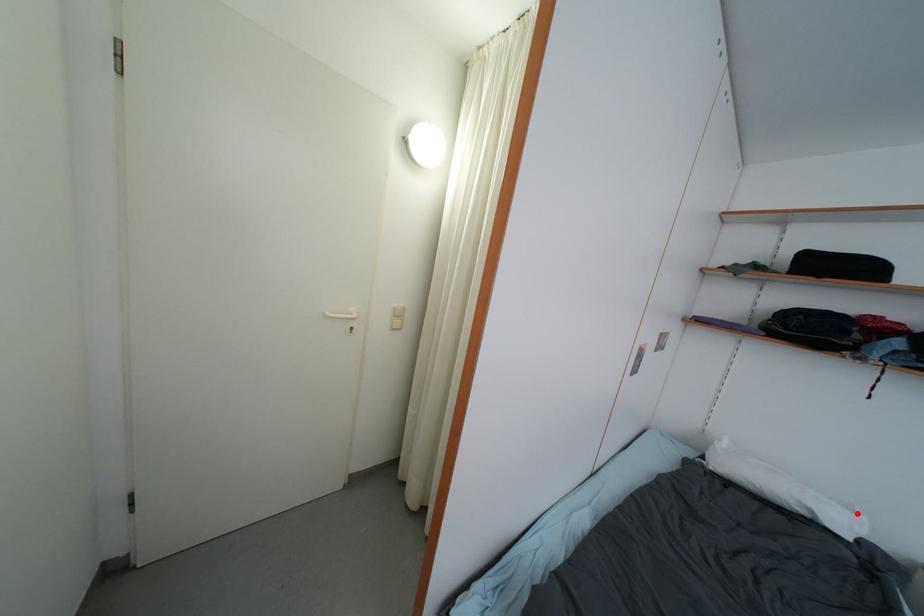
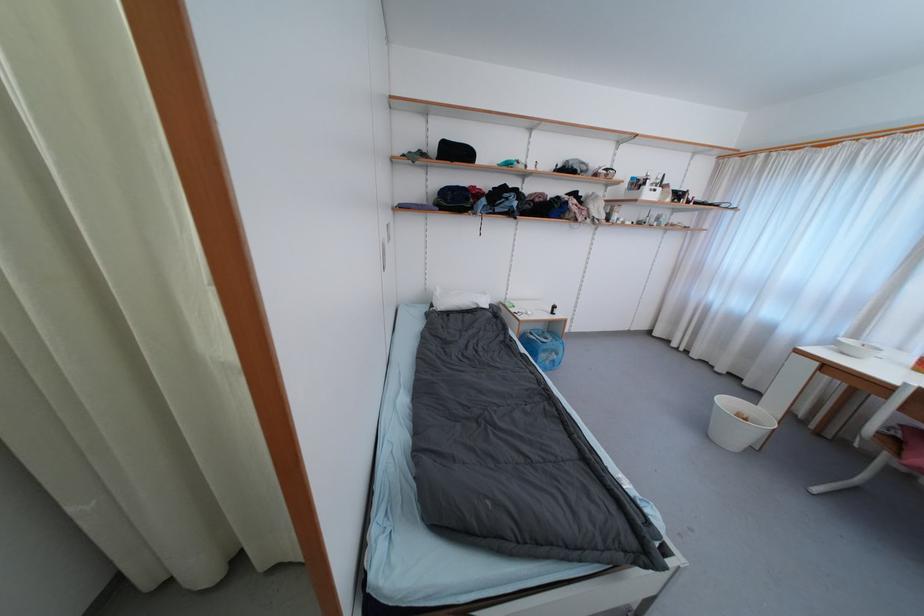
Question: I am providing you with two images of the same scene from different viewpoints. A red point is shown in image1. For the corresponding object point in image2, is it positioned nearer or farther from the camera?

Choices:
 (A) Nearer
 (B) Farther

Answer: (B)